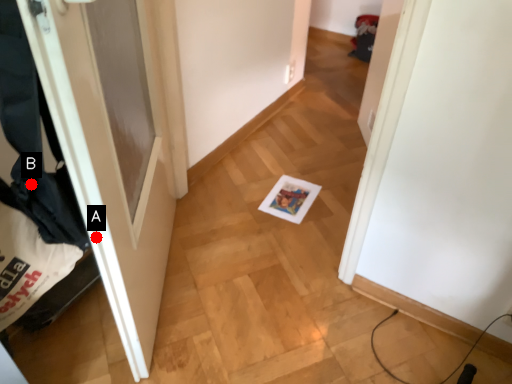
Question: Two points are circled on the image, labeled by A and B beside each circle. Which point is further to the camera?

Choices:
 (A) A is further
 (B) B is further

Answer: (A)